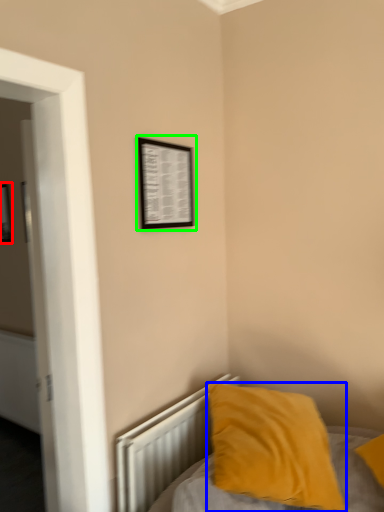
Question: Which is farther away from picture frame (highlighted by a red box)? pillow (highlighted by a blue box) or picture frame (highlighted by a green box)?

Choices:
 (A) pillow
 (B) picture frame

Answer: (A)